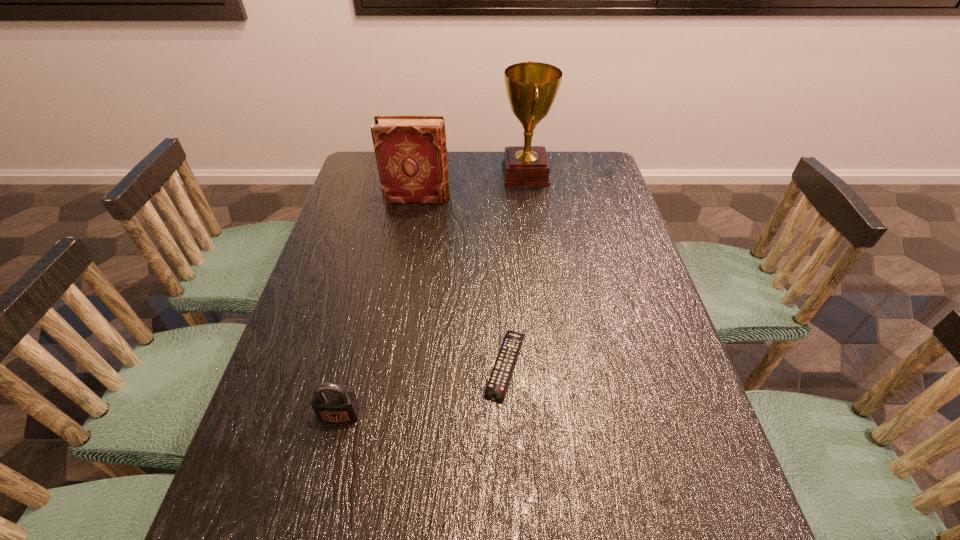
Identify the location of the third closest object to the hardback book. Image resolution: width=960 pixels, height=540 pixels. (331, 403).

This screenshot has width=960, height=540. I want to click on object that can be found as the closest to the third farthest object, so click(x=331, y=403).

The width and height of the screenshot is (960, 540). Find the location of `vacant space that satisfies the following two spatial constraints: 1. on the plaque of the award; 2. on the front of the nearest object near the keyhole`. vacant space that satisfies the following two spatial constraints: 1. on the plaque of the award; 2. on the front of the nearest object near the keyhole is located at coordinates (558, 415).

What are the coordinates of `free space that satisfies the following two spatial constraints: 1. on the spine side of the hardback book; 2. on the front of the nearest object near the keyhole` in the screenshot? It's located at (380, 415).

Where is `free point that satisfies the following two spatial constraints: 1. on the plaque of the tallest object; 2. on the front side of the remote control`? free point that satisfies the following two spatial constraints: 1. on the plaque of the tallest object; 2. on the front side of the remote control is located at coordinates (551, 365).

The height and width of the screenshot is (540, 960). In order to click on free space that satisfies the following two spatial constraints: 1. on the back side of the shortest object; 2. on the spine side of the hardback book in this screenshot , I will do `click(497, 198)`.

Find the location of a particular element. This screenshot has height=540, width=960. free point that satisfies the following two spatial constraints: 1. on the spine side of the remote control; 2. on the right side of the hardback book is located at coordinates (389, 365).

Where is `vacant region that satisfies the following two spatial constraints: 1. on the spine side of the hardback book; 2. on the front of the nearest object near the keyhole`? vacant region that satisfies the following two spatial constraints: 1. on the spine side of the hardback book; 2. on the front of the nearest object near the keyhole is located at coordinates (380, 415).

Identify the location of vacant space that satisfies the following two spatial constraints: 1. on the spine side of the third farthest object; 2. on the right side of the hardback book. (389, 365).

You are a GUI agent. You are given a task and a screenshot of the screen. Output one action in this format:
    pyautogui.click(x=<x>, y=<y>)
    Task: Click on the vacant region that satisfies the following two spatial constraints: 1. on the spine side of the hardback book; 2. on the back side of the shortest object
    Image resolution: width=960 pixels, height=540 pixels.
    Given the screenshot: What is the action you would take?
    pyautogui.click(x=389, y=365)